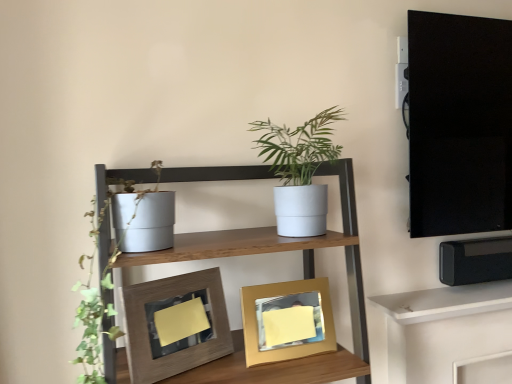
Question: Is the depth of wooden textured frame at center, the first picture frame in the left-to-right sequence, less than that of white matte pot at center?

Choices:
 (A) yes
 (B) no

Answer: (A)

Question: Is wooden textured frame at center, the first picture frame in the left-to-right sequence, to the left of white matte pot at center from the viewer's perspective?

Choices:
 (A) yes
 (B) no

Answer: (A)

Question: Is wooden textured frame at center, which appears as the 2th picture frame when viewed from the right, facing towards white matte pot at center?

Choices:
 (A) no
 (B) yes

Answer: (A)

Question: Considering the relative sizes of wooden textured frame at center, which appears as the 2th picture frame when viewed from the right, and white matte pot at center in the image provided, is wooden textured frame at center, which appears as the 2th picture frame when viewed from the right, shorter than white matte pot at center?

Choices:
 (A) no
 (B) yes

Answer: (B)

Question: Would you say wooden textured frame at center, which appears as the 2th picture frame when viewed from the right, contains white matte pot at center?

Choices:
 (A) yes
 (B) no

Answer: (B)

Question: Considering the relative sizes of wooden textured frame at center, the first picture frame in the left-to-right sequence, and white matte pot at center in the image provided, is wooden textured frame at center, the first picture frame in the left-to-right sequence, taller than white matte pot at center?

Choices:
 (A) no
 (B) yes

Answer: (A)

Question: Is wooden textured frame at center, which appears as the 2th picture frame when viewed from the right, positioned in front of matte white pot at left?

Choices:
 (A) no
 (B) yes

Answer: (A)

Question: Can you confirm if wooden textured frame at center, which appears as the 2th picture frame when viewed from the right, is shorter than matte white pot at left?

Choices:
 (A) yes
 (B) no

Answer: (A)

Question: Is wooden textured frame at center, which appears as the 2th picture frame when viewed from the right, in contact with matte white pot at left?

Choices:
 (A) yes
 (B) no

Answer: (B)

Question: From the image's perspective, is wooden textured frame at center, the first picture frame in the left-to-right sequence, located above matte white pot at left?

Choices:
 (A) no
 (B) yes

Answer: (A)

Question: Is wooden textured frame at center, which appears as the 2th picture frame when viewed from the right, positioned with its back to matte white pot at left?

Choices:
 (A) no
 (B) yes

Answer: (B)

Question: Does wooden textured frame at center, which appears as the 2th picture frame when viewed from the right, come behind matte white pot at left?

Choices:
 (A) yes
 (B) no

Answer: (A)

Question: From the image's perspective, would you say white matte shelf at upper right, marked as the first shelf in a right-to-left arrangement, is positioned over wooden textured frame at center, the first picture frame in the left-to-right sequence?

Choices:
 (A) yes
 (B) no

Answer: (B)